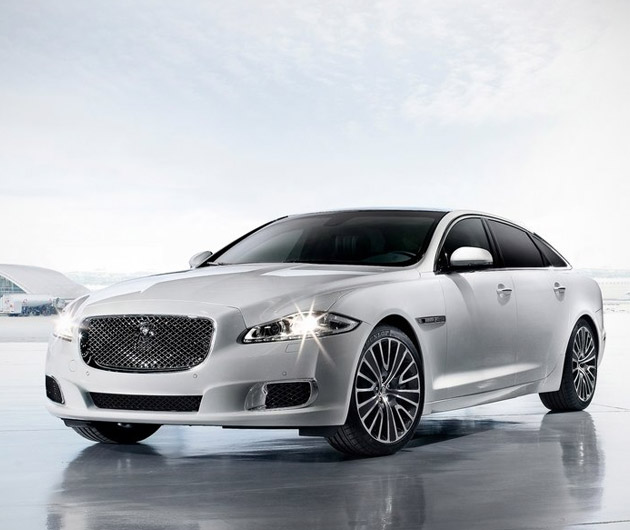
What are the coordinates of `door handles` in the screenshot? It's located at (503, 290), (559, 288).